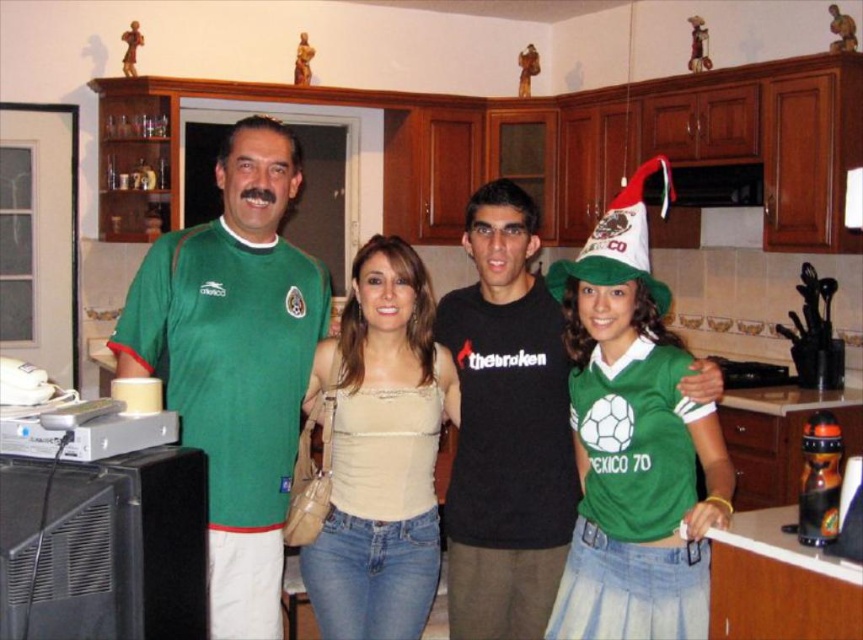
Is point (249, 228) closer to camera compared to point (551, 508)?

Yes, it is in front of point (551, 508).

Which is more to the left, green jersey at center or black matte t-shirt at center?

Positioned to the left is green jersey at center.

Locate an element on the screen. green jersey at center is located at coordinates (235, 362).

Which is in front, point (530, 576) or point (273, 492)?

Positioned in front is point (273, 492).

Does matte green jersey at center appear on the left side of green jersey at center?

Yes, matte green jersey at center is to the left of green jersey at center.

Identify the location of matte green jersey at center. The height and width of the screenshot is (640, 863). (244, 324).

Consider the image. Which is below, black matte t-shirt at center or green felt christmas hat at center right?

black matte t-shirt at center is lower down.

Does black matte t-shirt at center appear over green felt christmas hat at center right?

No, black matte t-shirt at center is not above green felt christmas hat at center right.

You are a GUI agent. You are given a task and a screenshot of the screen. Output one action in this format:
    pyautogui.click(x=<x>, y=<y>)
    Task: Click on the black matte t-shirt at center
    
    Given the screenshot: What is the action you would take?
    pyautogui.click(x=506, y=428)

This screenshot has height=640, width=863. What are the coordinates of `black matte t-shirt at center` in the screenshot? It's located at (506, 428).